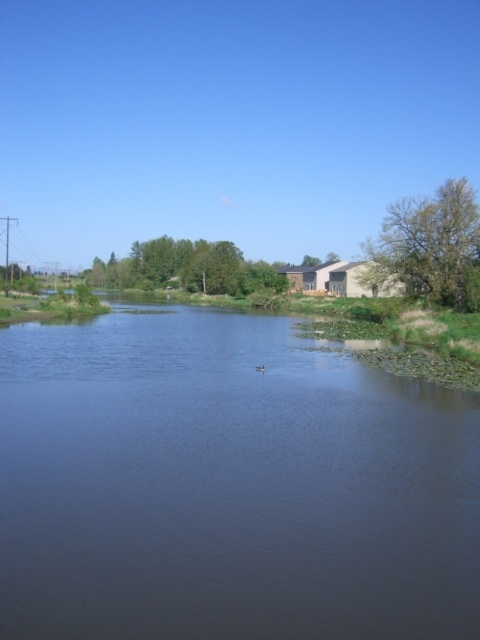
Can you confirm if dark blue water at center is thinner than brown fuzzy duck at center?

No.

Who is more forward, (276,584) or (257,369)?

Positioned in front is point (276,584).

Locate an element on the screen. The image size is (480, 640). dark blue water at center is located at coordinates (228, 484).